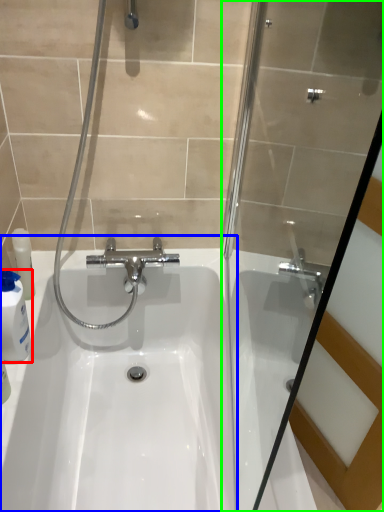
Question: Based on their relative distances, which object is farther from cleaning product (highlighted by a red box)? Choose from sink (highlighted by a blue box) and shower door (highlighted by a green box).

Choices:
 (A) sink
 (B) shower door

Answer: (B)